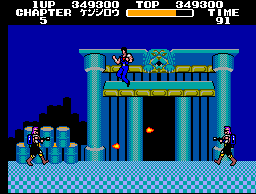
Image resolution: width=256 pixels, height=194 pixels. I want to click on columns, so click(91, 105), click(223, 100).